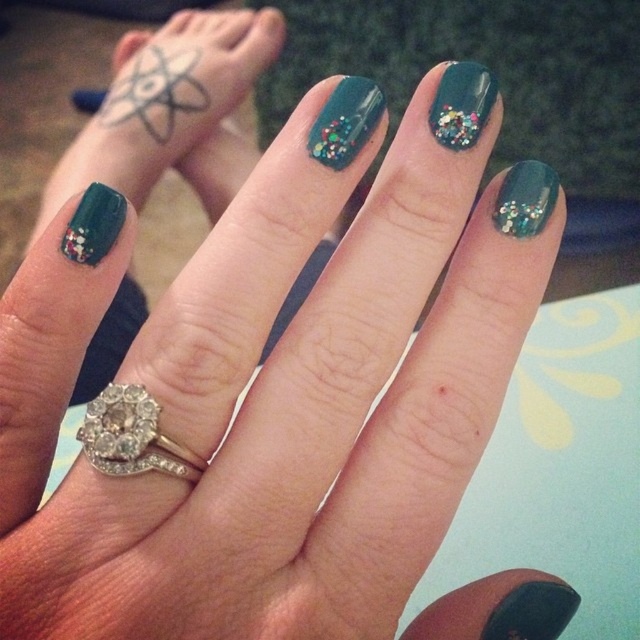
Question: Which of these objects is positioned farthest from the teal glitter nail polish at center?

Choices:
 (A) black ink atom at upper left
 (B) teal glitter nail polish at upper right
 (C) glittery teal nail at upper right
 (D) diamondmetallicring at center

Answer: (A)

Question: Is diamondmetallicring at center bigger than teal glitter nail polish at upper right?

Choices:
 (A) yes
 (B) no

Answer: (B)

Question: Among these objects, which one is farthest from the camera?

Choices:
 (A) diamondmetallicring at center
 (B) teal glitter nail polish at upper right

Answer: (B)

Question: Is black ink atom at upper left smaller than teal glitter nail polish at upper right?

Choices:
 (A) no
 (B) yes

Answer: (A)

Question: In this image, where is diamondmetallicring at center located relative to glittery teal nail at upper right?

Choices:
 (A) above
 (B) below

Answer: (B)

Question: Which of the following is the closest to the observer?

Choices:
 (A) (356, 138)
 (B) (515, 228)
 (C) (172, 109)
 (D) (116, 472)

Answer: (D)